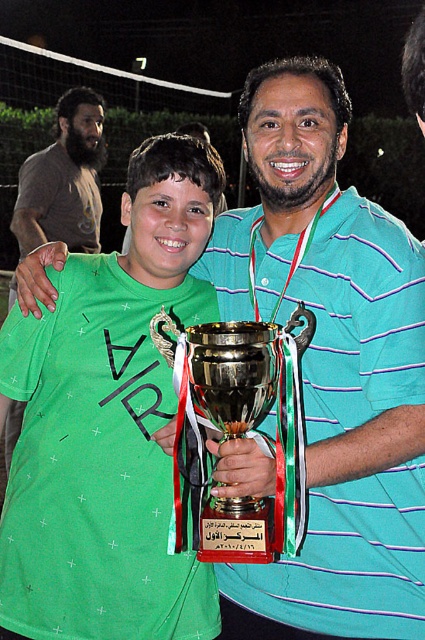
Who is higher up, green matte shirt at center or gold metallic trophy at center?

green matte shirt at center

Between green matte shirt at center and gold metallic trophy at center, which one has more height?

green matte shirt at center is taller.

Where is `green matte shirt at center`? This screenshot has height=640, width=425. green matte shirt at center is located at coordinates (108, 424).

Where is `green matte shirt at center`? The image size is (425, 640). green matte shirt at center is located at coordinates (108, 424).

Can you confirm if green matte shirt at center is shorter than dark brown t-shirt at left?

Indeed, green matte shirt at center has a lesser height compared to dark brown t-shirt at left.

Which is behind, point (176, 305) or point (91, 173)?

The point (91, 173) is behind.

You are a GUI agent. You are given a task and a screenshot of the screen. Output one action in this format:
    pyautogui.click(x=<x>, y=<y>)
    Task: Click on the green matte shirt at center
    
    Given the screenshot: What is the action you would take?
    pyautogui.click(x=108, y=424)

Where is `green matte shirt at center`? Image resolution: width=425 pixels, height=640 pixels. green matte shirt at center is located at coordinates (108, 424).

I want to click on gold metallic trophy at center, so [240, 435].

Based on the photo, measure the distance between point (178, 484) and camera.

Point (178, 484) and camera are 4.71 feet apart from each other.

Does point (226, 436) come behind point (68, 230)?

No.

The height and width of the screenshot is (640, 425). I want to click on gold metallic trophy at center, so click(240, 435).